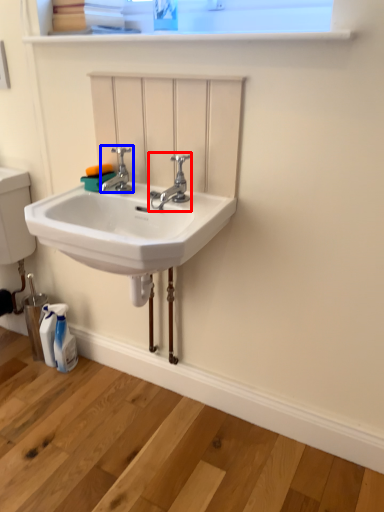
Question: Among these objects, which one is farthest to the camera, tap (highlighted by a red box) or tap (highlighted by a blue box)?

Choices:
 (A) tap
 (B) tap

Answer: (B)